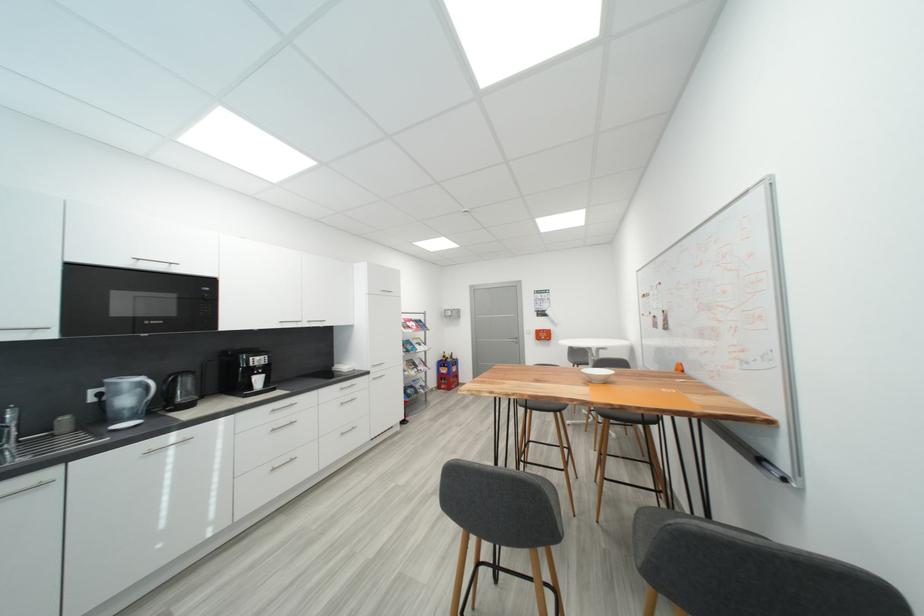
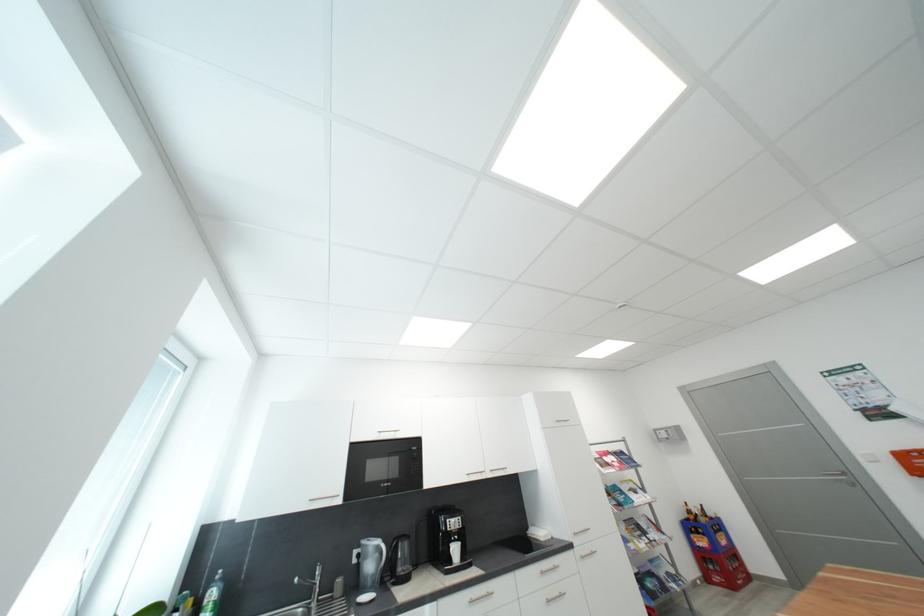
The point at (x=148, y=403) is marked in the first image. Where is the corresponding point in the second image?

(383, 570)